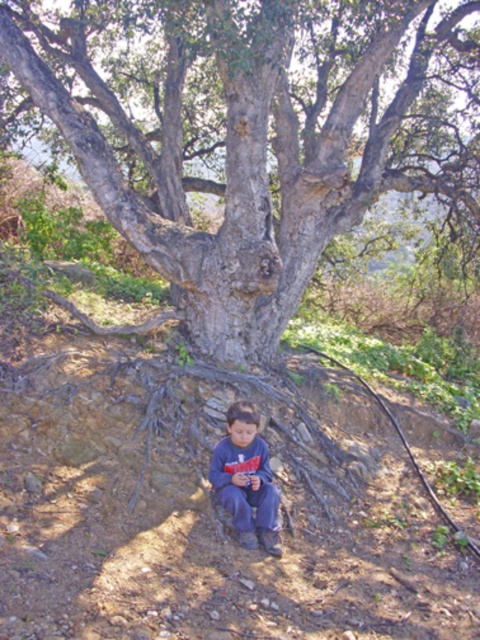
You are a photographer trying to capture the entire scene of the gray rough bark tree at center and the dark blue jeans at lower center. Which object would you need to focus on first if you want to ensure both are fully visible in the frame?

The gray rough bark tree at center occupies less space than the dark blue jeans at lower center. To ensure both are fully visible, focus on the larger object first, which is the dark blue jeans at lower center, then adjust the frame to include the smaller gray rough bark tree at center.

Consider the image. You are standing at the base of the large tree and want to walk towards the point labeled as point (x=222, y=470). If there is an object at point (x=457, y=204), would it block your path?

Point (x=457, y=204) is behind point (x=222, y=470), so it would not block your path to point (x=222, y=470).